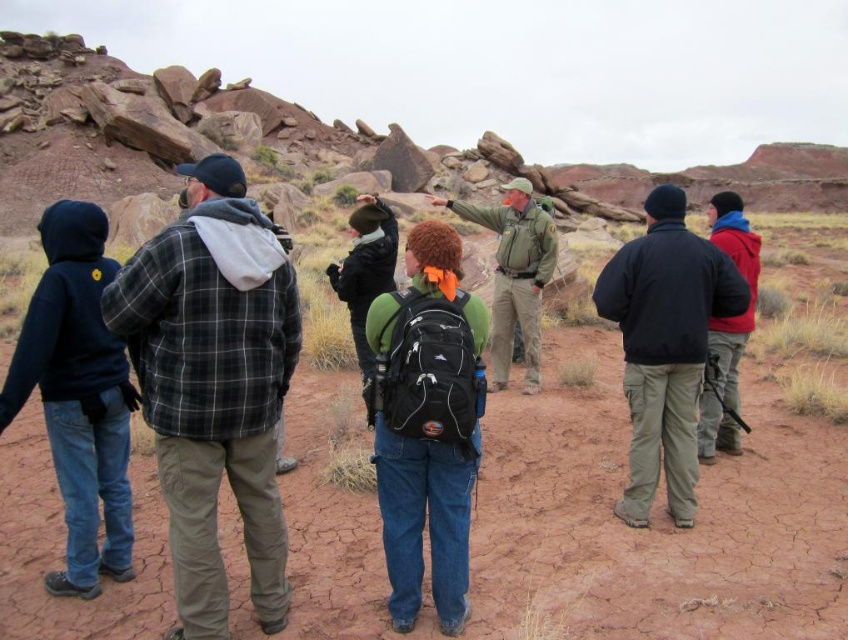
Who is more distant from viewer, [389,600] or [388,216]?

Point [388,216]

In the scene shown: Is black fabric backpack at center bigger than matte black backpack at center?

Correct, black fabric backpack at center is larger in size than matte black backpack at center.

In order to click on black fabric backpack at center in this screenshot , I will do pyautogui.click(x=427, y=422).

Identify the location of black fabric backpack at center. The height and width of the screenshot is (640, 848). (427, 422).

Is green matte jacket at center closer to camera compared to matte black backpack at center?

No, green matte jacket at center is further to the viewer.

Between green matte jacket at center and matte black backpack at center, which one appears on the left side from the viewer's perspective?

Positioned to the left is matte black backpack at center.

Between point (509, 243) and point (364, 218), which one is positioned in front?

Point (364, 218)

Locate an element on the screen. green matte jacket at center is located at coordinates (514, 275).

Consider the image. Is plaid flannel shirt at left wider than dark blue hoodie at left?

Yes.

Does plaid flannel shirt at left have a smaller size compared to dark blue hoodie at left?

Actually, plaid flannel shirt at left might be larger than dark blue hoodie at left.

Which is behind, point (118, 273) or point (87, 364)?

The point (87, 364) is more distant.

You are a GUI agent. You are given a task and a screenshot of the screen. Output one action in this format:
    pyautogui.click(x=<x>, y=<y>)
    Task: Click on the plaid flannel shirt at left
    The height and width of the screenshot is (640, 848).
    Given the screenshot: What is the action you would take?
    pyautogui.click(x=215, y=385)